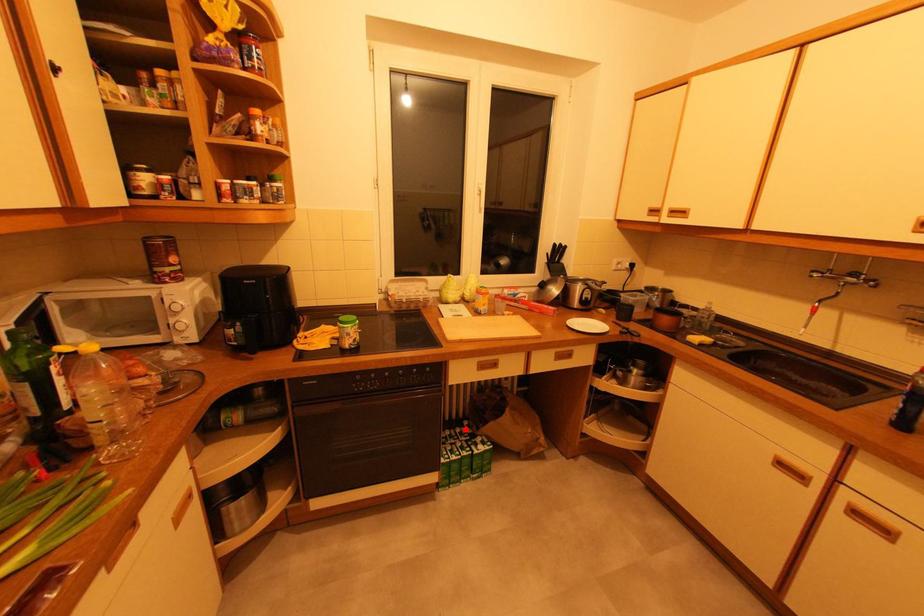
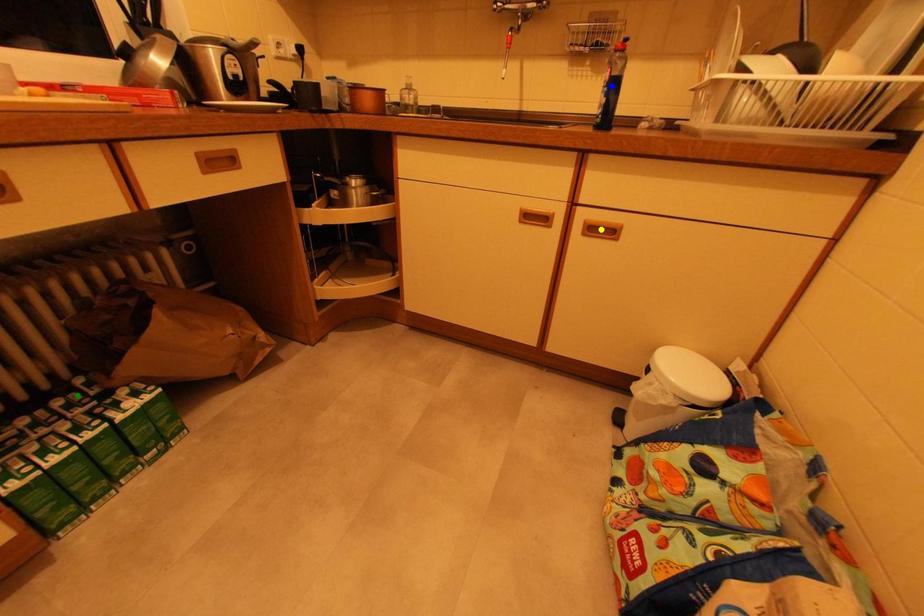
Question: I am providing you with two images of the same scene from different viewpoints. A red point is marked on the first image. You are given multiple points on the second image. Can you choose the point in image 2 that corresponds to the point in image 1?

Choices:
 (A) yellow point
 (B) blue point
 (C) green point

Answer: (C)